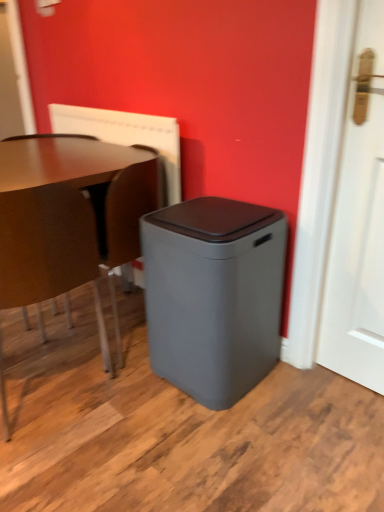
Question: Does point (162, 374) appear closer or farther from the camera than point (61, 189)?

Choices:
 (A) farther
 (B) closer

Answer: (A)

Question: In the image, is gray matte waste container at center on the left side or the right side of matte brown chair at left?

Choices:
 (A) right
 (B) left

Answer: (A)

Question: Which of these objects is positioned closest to the brown leather swivel chair at lower left?

Choices:
 (A) matte brown chair at left
 (B) gray matte waste container at center
 (C) white matte door at right
 (D) white textured radiator at upper center

Answer: (D)

Question: Considering the real-world distances, which object is farthest from the gray matte waste container at center?

Choices:
 (A) white matte door at right
 (B) matte brown chair at left
 (C) white textured radiator at upper center
 (D) brown leather swivel chair at lower left

Answer: (C)